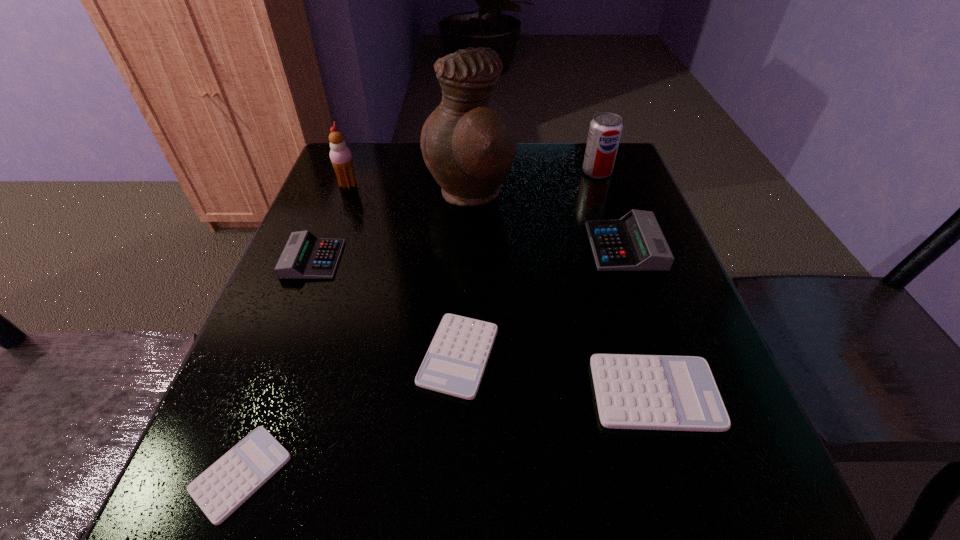
Where is `free space located 0.050m on the left of the second smallest white calculator`? Image resolution: width=960 pixels, height=540 pixels. free space located 0.050m on the left of the second smallest white calculator is located at coordinates (390, 356).

Identify the location of vacant region located 0.370m on the back of the leftmost white calculator. (321, 262).

Image resolution: width=960 pixels, height=540 pixels. Find the location of `pitcher that is at the far edge`. pitcher that is at the far edge is located at coordinates (469, 142).

This screenshot has height=540, width=960. I want to click on icecream present at the far edge, so click(340, 155).

You are a GUI agent. You are given a task and a screenshot of the screen. Output one action in this format:
    pyautogui.click(x=<x>, y=<y>)
    Task: Click on the soda present at the far edge
    Image resolution: width=960 pixels, height=540 pixels.
    Given the screenshot: What is the action you would take?
    pyautogui.click(x=605, y=130)

What are the coordinates of `object located in the near edge section of the desktop` in the screenshot? It's located at (222, 488).

At what (x,y) coordinates should I click in order to perform the action: click on icecream present at the left edge. Please return your answer as a coordinate pair (x, y). The width and height of the screenshot is (960, 540). Looking at the image, I should click on (340, 155).

Locate an element on the screen. Image resolution: width=960 pixels, height=540 pixels. soda that is at the right edge is located at coordinates (605, 130).

You are a GUI agent. You are given a task and a screenshot of the screen. Output one action in this format:
    pyautogui.click(x=<x>, y=<y>)
    Task: Click on the object that is at the far left corner
    
    Given the screenshot: What is the action you would take?
    pyautogui.click(x=340, y=155)

This screenshot has width=960, height=540. I want to click on object present at the near left corner, so click(222, 488).